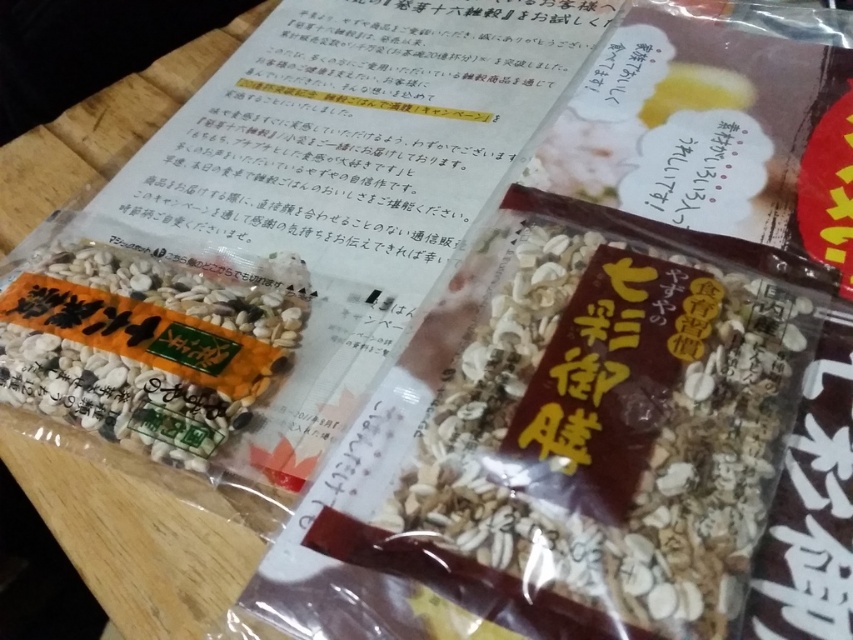
Can you confirm if brown matte granola at center is positioned to the left of white matte seeds at center?

In fact, brown matte granola at center is to the right of white matte seeds at center.

Consider the image. Does brown matte granola at center have a lesser width compared to white matte seeds at center?

No.

What do you see at coordinates (604, 435) in the screenshot?
I see `brown matte granola at center` at bounding box center [604, 435].

Identify the location of brown matte granola at center. Image resolution: width=853 pixels, height=640 pixels. (604, 435).